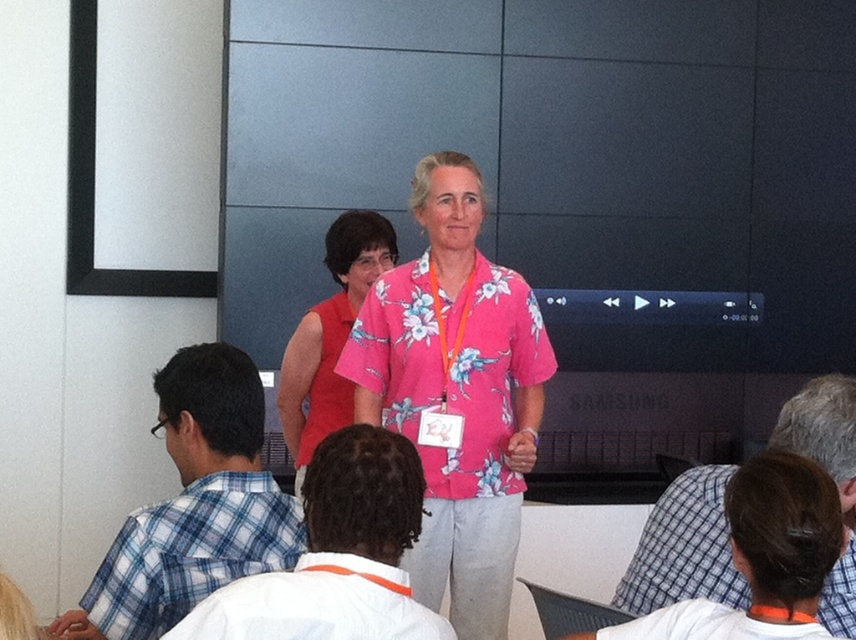
You are an event organizer who needs to ensure that all speakers have enough space to move comfortably during their presentation. You notice two speakers wearing the floral print shirt at center and the blue plaid shirt at left. Based on their clothing sizes, which speaker might require more lateral space due to their attire?

The floral print shirt at center requires more lateral space because its width is larger than the blue plaid shirt at left.

In the presentation scene, there are two speakers and an audience. The speakers are wearing a vibrant pink floral shirt paired with light gray pants and an orange lanyard, and a red sleeveless top with an orange lanyard. The audience is seated in rows facing the speakers. There is a point at coordinates (337, 554). What object is located at this point?

The point at coordinates (337, 554) indicates the white cotton shirt at center.